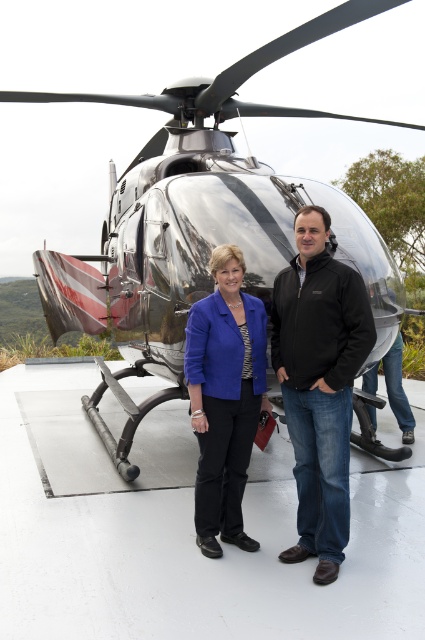
What do you see at coordinates (319, 385) in the screenshot? I see `black matte jacket at center` at bounding box center [319, 385].

Can you confirm if black matte jacket at center is smaller than matte blue blazer at center?

Actually, black matte jacket at center might be larger than matte blue blazer at center.

Between point (314, 492) and point (227, 250), which one is positioned behind?

Point (227, 250)

The height and width of the screenshot is (640, 425). What are the coordinates of `black matte jacket at center` in the screenshot? It's located at (319, 385).